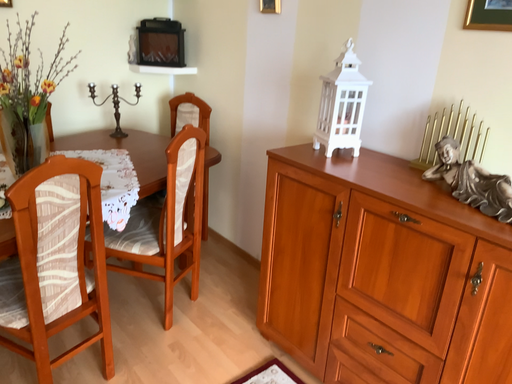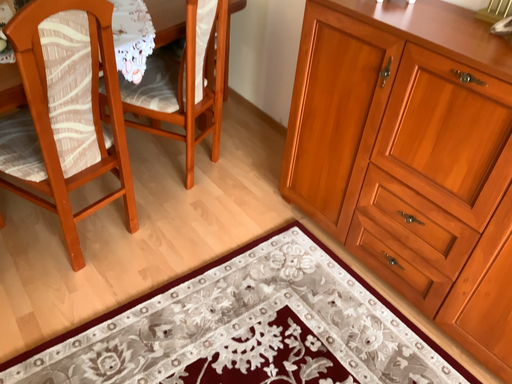
Question: How did the camera likely rotate when shooting the video?

Choices:
 (A) rotated upward
 (B) rotated downward

Answer: (B)